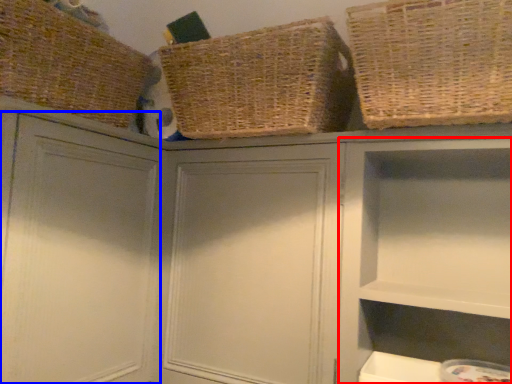
Question: Which object appears closest to the camera in this image, cabinet (highlighted by a red box) or cabinet (highlighted by a blue box)?

Choices:
 (A) cabinet
 (B) cabinet

Answer: (B)